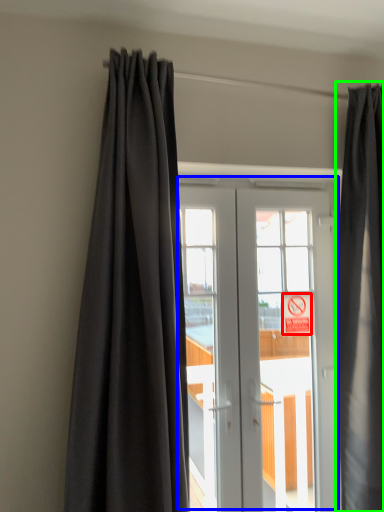
Question: Based on their relative distances, which object is farther from parking sign (highlighted by a red box)? Choose from door (highlighted by a blue box) and curtain (highlighted by a green box).

Choices:
 (A) door
 (B) curtain

Answer: (B)